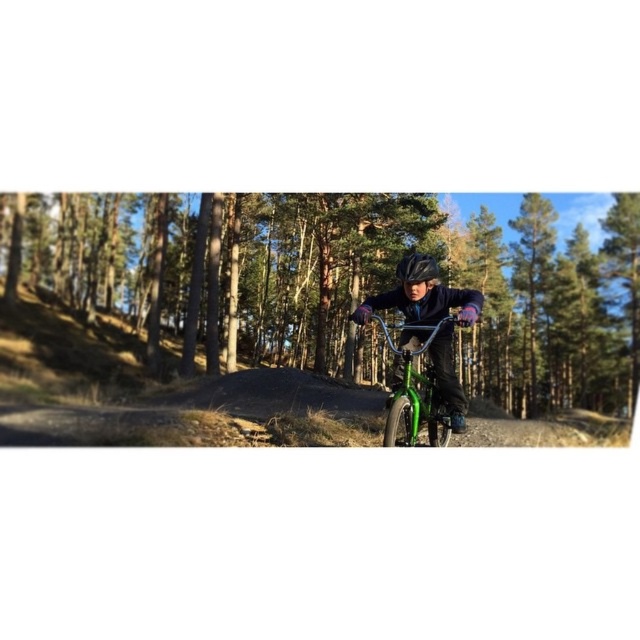
You are a photographer planning to take a closeup shot of the green metallic bicycle at center and the green matte mountain bike at center. Which one would you need to move closer to the camera to ensure both appear the same size in the photo?

The green metallic bicycle at center is bigger than the green matte mountain bike at center, so you would need to move the green matte mountain bike at center closer to the camera to make them appear the same size in the photo.

You are a cyclist planning to ride along the forest trail shown in the image. You see the green metallic bicycle at center and the green matte mountain bike at center. If you want to place your bike between them, will there be enough space for your bike which is 1.5 meters long?

The distance between the green metallic bicycle at center and the green matte mountain bike at center is 31.33 meters. Since your bike is only 1.5 meters long, there is more than enough space to place it between them.

You are a cyclist navigating a forest trail. You notice two points marked on your GPS map at coordinates point (573, 243) and point (419, 406). Which point should you reach first while moving forward along the trail?

You should reach point (419, 406) first because point (573, 243) is located behind it along your path.